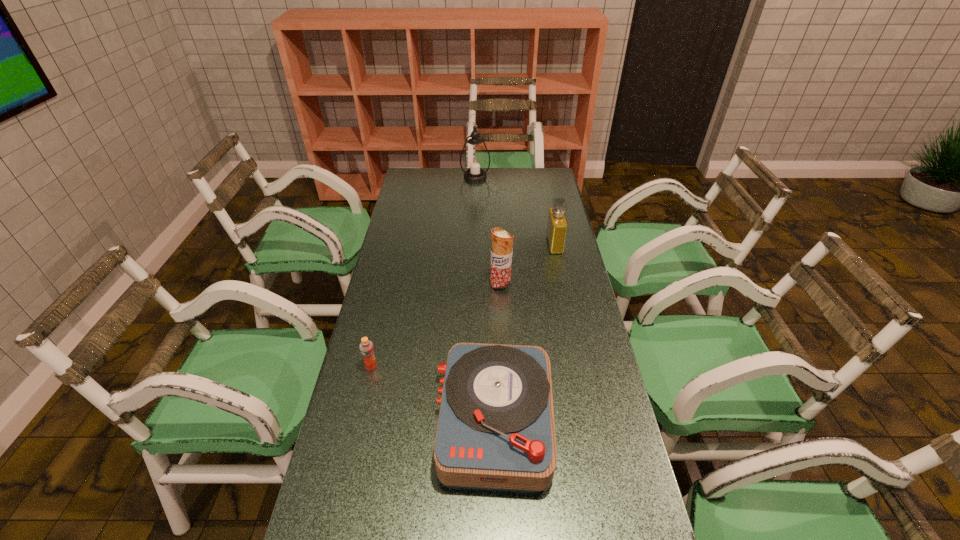
Find the location of a particular element. This screenshot has width=960, height=540. free space located on the front-facing side of the fourth nearest object is located at coordinates click(469, 245).

This screenshot has height=540, width=960. What are the coordinates of `vacant space located on the front-facing side of the fourth nearest object` in the screenshot? It's located at (530, 245).

Locate an element on the screen. The width and height of the screenshot is (960, 540). vacant space located on the front-facing side of the fourth nearest object is located at coordinates (513, 245).

The height and width of the screenshot is (540, 960). Identify the location of blank space located 0.180m on the back of the record player. (492, 318).

This screenshot has width=960, height=540. I want to click on vacant region located on the right of the orange juice, so click(x=492, y=367).

The width and height of the screenshot is (960, 540). Find the location of `object at the far edge`. object at the far edge is located at coordinates (475, 160).

Locate an element on the screen. object at the left edge is located at coordinates (366, 347).

This screenshot has height=540, width=960. I want to click on object at the right edge, so click(557, 225).

Identify the location of free point at the far edge. (446, 170).

You are a GUI agent. You are given a task and a screenshot of the screen. Output one action in this format:
    pyautogui.click(x=<x>, y=<y>)
    Task: Click on the free space at the left edge of the desktop
    Image resolution: width=960 pixels, height=540 pixels.
    Given the screenshot: What is the action you would take?
    pyautogui.click(x=354, y=504)